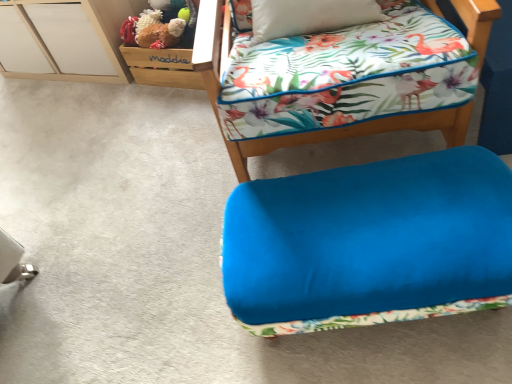
Find the location of `free spot to the left of velvet blue ottoman at lower right, which appears as the first furniture when ordered from the bottom`. free spot to the left of velvet blue ottoman at lower right, which appears as the first furniture when ordered from the bottom is located at coordinates (170, 290).